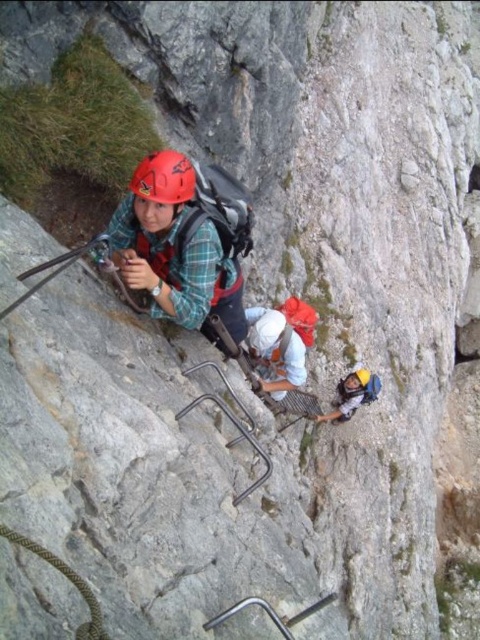
You are a photographer standing at the base of the cliff. You want to take a photo of the white fabric helmet at center and the brown textured rope at lower left. Which object will appear closer to the front of the photo?

The white fabric helmet at center will appear closer to the front of the photo because the brown textured rope at lower left is behind it.

You are a safety inspector evaluating the climbing gear of the two climbers with the matte black helmet at upper center and the matte yellow helmet at lower center. Which helmet has a greater diameter?

The matte black helmet at upper center has a larger size compared to the matte yellow helmet at lower center, so the matte black helmet at upper center has a greater diameter.